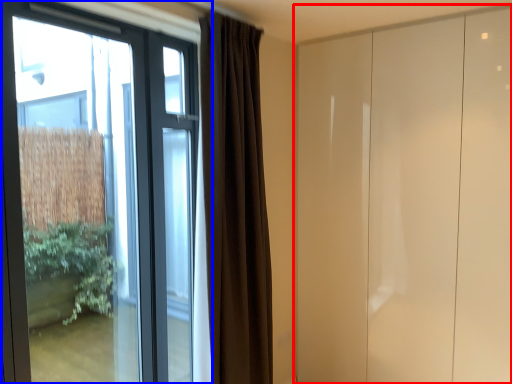
Question: Which of the following is the farthest to the observer, door (highlighted by a red box) or window (highlighted by a blue box)?

Choices:
 (A) door
 (B) window

Answer: (A)